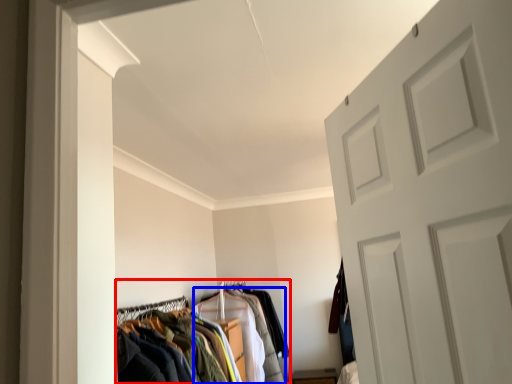
Question: Which of the following is the farthest to the observer, closet (highlighted by a red box) or clothing (highlighted by a blue box)?

Choices:
 (A) closet
 (B) clothing

Answer: (B)